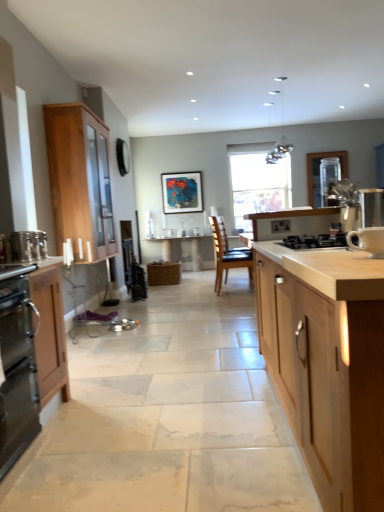
Question: Is brown leather chair at center located outside metallic glass pendant lights at upper center?

Choices:
 (A) no
 (B) yes

Answer: (B)

Question: Considering the relative sizes of brown leather chair at center and metallic glass pendant lights at upper center in the image provided, is brown leather chair at center wider than metallic glass pendant lights at upper center?

Choices:
 (A) no
 (B) yes

Answer: (B)

Question: Can you see brown leather chair at center touching metallic glass pendant lights at upper center?

Choices:
 (A) yes
 (B) no

Answer: (B)

Question: Does brown leather chair at center contain metallic glass pendant lights at upper center?

Choices:
 (A) yes
 (B) no

Answer: (B)

Question: Can you confirm if brown leather chair at center is thinner than metallic glass pendant lights at upper center?

Choices:
 (A) yes
 (B) no

Answer: (B)

Question: Based on their positions, is brown leather chair at center located to the left or right of light wood cabinet at center, which ranks as the third cabinetry in back-to-front order?

Choices:
 (A) right
 (B) left

Answer: (B)

Question: Considering their positions, is brown leather chair at center located in front of or behind light wood cabinet at center, positioned as the first cabinetry in right-to-left order?

Choices:
 (A) front
 (B) behind

Answer: (B)

Question: Is brown leather chair at center situated inside light wood cabinet at center, positioned as the first cabinetry in right-to-left order, or outside?

Choices:
 (A) inside
 (B) outside

Answer: (B)

Question: From the image's perspective, is brown leather chair at center located above or below light wood cabinet at center, which is counted as the 1th cabinetry, starting from the front?

Choices:
 (A) above
 (B) below

Answer: (A)

Question: In the image, is light wood cabinet at center, the 3th cabinetry positioned from the left, positioned in front of or behind black matte gas stove at center?

Choices:
 (A) front
 (B) behind

Answer: (A)

Question: Is light wood cabinet at center, which is counted as the 1th cabinetry, starting from the front, bigger or smaller than black matte gas stove at center?

Choices:
 (A) big
 (B) small

Answer: (A)

Question: From a real-world perspective, is light wood cabinet at center, positioned as the first cabinetry in right-to-left order, above or below black matte gas stove at center?

Choices:
 (A) below
 (B) above

Answer: (A)

Question: Does point (342, 273) appear closer or farther from the camera than point (342, 238)?

Choices:
 (A) closer
 (B) farther

Answer: (A)

Question: Is wooden table at center bigger or smaller than black matte gas stove at center?

Choices:
 (A) big
 (B) small

Answer: (A)

Question: Would you say wooden table at center is to the left or to the right of black matte gas stove at center in the picture?

Choices:
 (A) right
 (B) left

Answer: (B)